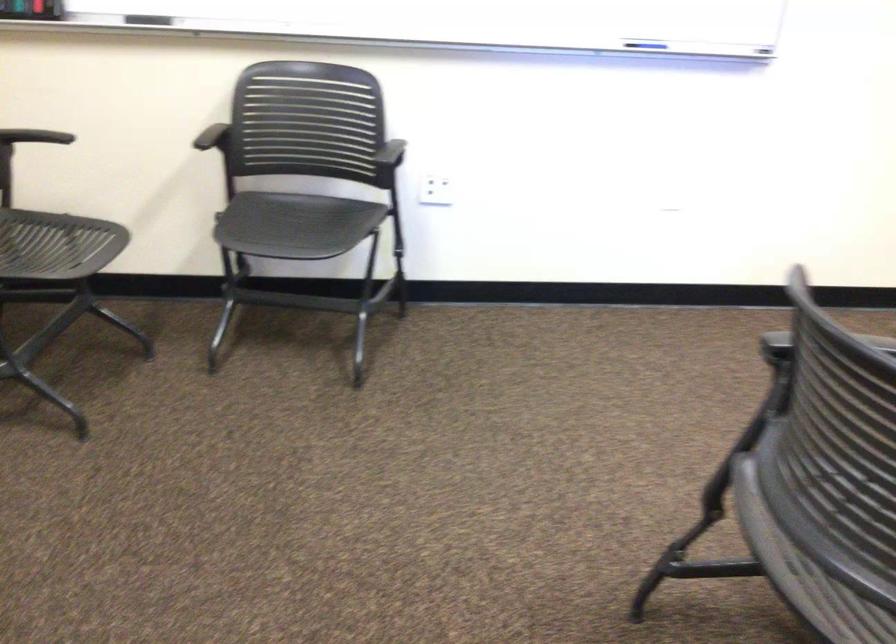
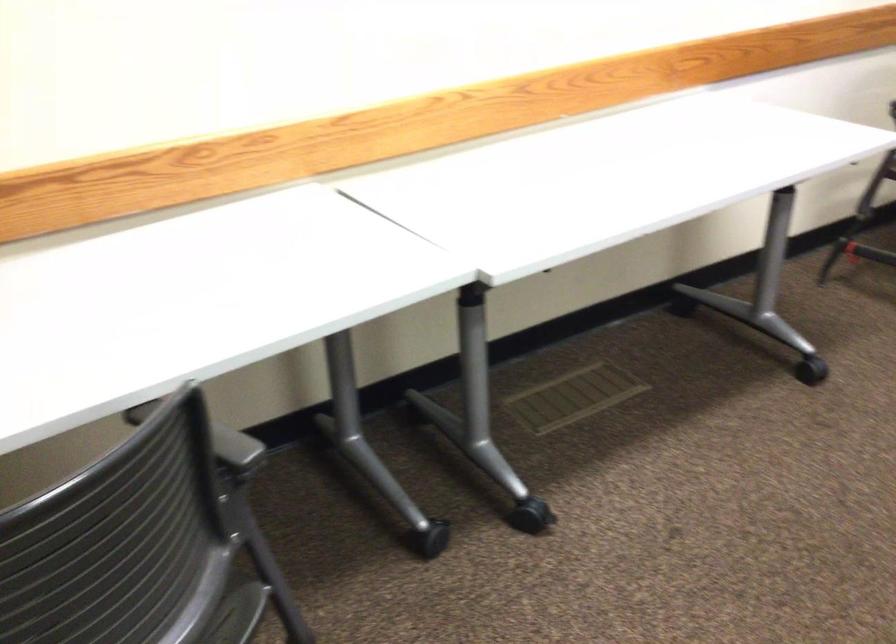
Question: The camera is either moving clockwise (left) or counter-clockwise (right) around the object. The first image is from the beginning of the video and the second image is from the end. Is the camera moving left or right when shooting the video?

Choices:
 (A) Left
 (B) Right

Answer: (B)